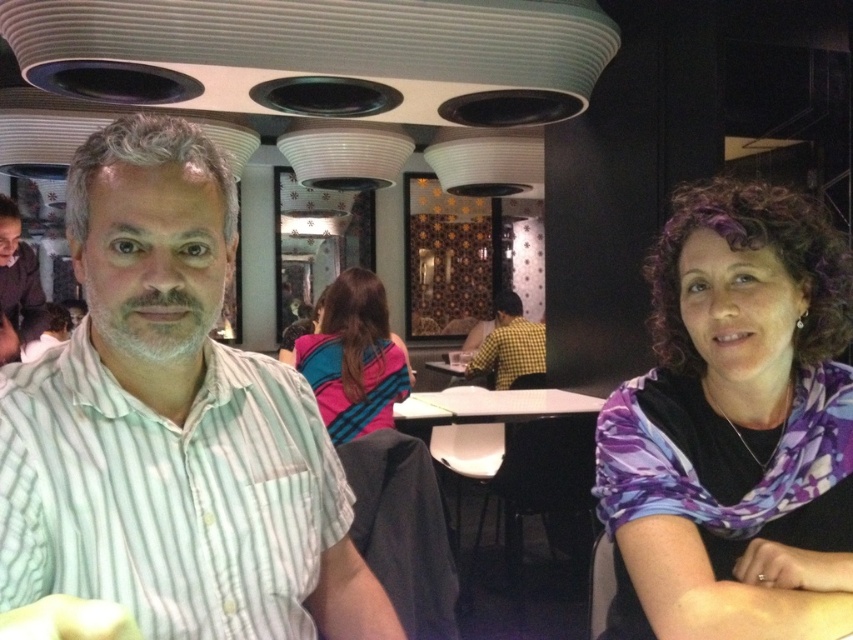
Which is more to the right, light green striped shirt at left or purple printed scarf at right?

Positioned to the right is purple printed scarf at right.

Based on the photo, is the position of light green striped shirt at left less distant than that of purple printed scarf at right?

Yes, light green striped shirt at left is in front of purple printed scarf at right.

Between point (256, 634) and point (747, 358), which one is positioned in front?

Point (256, 634) is more forward.

The height and width of the screenshot is (640, 853). What are the coordinates of `light green striped shirt at left` in the screenshot? It's located at (172, 426).

Which is above, light green striped shirt at left or checkered fabric shirt at center?

checkered fabric shirt at center

In the scene shown: Is light green striped shirt at left below checkered fabric shirt at center?

Indeed, light green striped shirt at left is positioned under checkered fabric shirt at center.

Is point (186, 163) farther from camera compared to point (479, 349)?

No, (186, 163) is closer to viewer.

The image size is (853, 640). What are the coordinates of `light green striped shirt at left` in the screenshot? It's located at (172, 426).

Does purple printed scarf at right appear under checkered fabric shirt at center?

No, purple printed scarf at right is not below checkered fabric shirt at center.

Between point (775, 202) and point (509, 296), which one is positioned behind?

Positioned behind is point (509, 296).

Identify the location of purple printed scarf at right. The height and width of the screenshot is (640, 853). (735, 428).